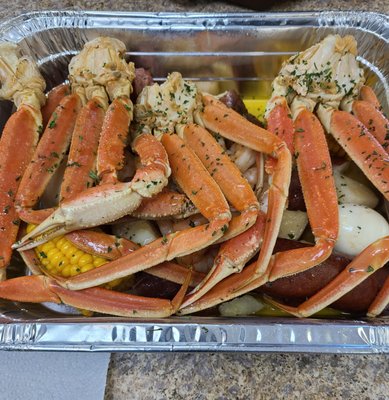
Locate an element on the screen. This screenshot has height=400, width=389. edge of paper towel is located at coordinates (105, 385).